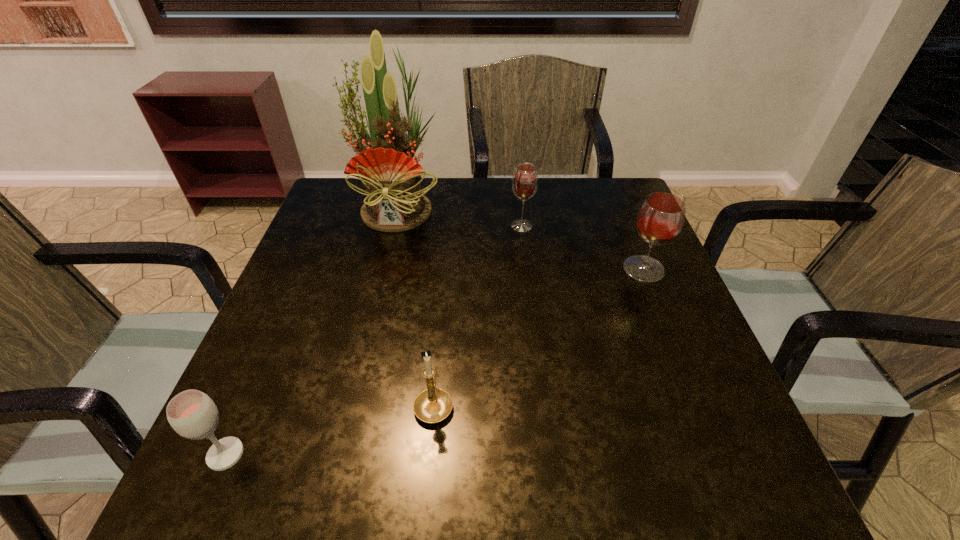
Find the location of a particular element. The width and height of the screenshot is (960, 540). flower arrangement is located at coordinates (391, 177).

Locate an element on the screen. The image size is (960, 540). the third nearest object is located at coordinates (661, 216).

Locate an element on the screen. The height and width of the screenshot is (540, 960). the rightmost wineglass is located at coordinates [661, 216].

You are a GUI agent. You are given a task and a screenshot of the screen. Output one action in this format:
    pyautogui.click(x=<x>, y=<y>)
    Task: Click on the second object from right to left
    
    Given the screenshot: What is the action you would take?
    pyautogui.click(x=525, y=181)

Find the location of `the farthest wineglass`. the farthest wineglass is located at coordinates [x=525, y=181].

Find the location of a particular element. candle holder is located at coordinates (432, 405).

Where is `the leftmost wineglass`? the leftmost wineglass is located at coordinates (192, 414).

You are a GUI agent. You are given a task and a screenshot of the screen. Output one action in this format:
    pyautogui.click(x=<x>, y=<y>)
    Task: Click on the leftmost object
    This screenshot has height=540, width=960.
    Given the screenshot: What is the action you would take?
    pyautogui.click(x=192, y=414)

This screenshot has height=540, width=960. Find the location of `vacant area located 0.140m in front of the flower arrangement with the fan visible`. vacant area located 0.140m in front of the flower arrangement with the fan visible is located at coordinates (384, 273).

Identify the location of blank space located on the left of the second farthest wineglass. This screenshot has height=540, width=960. (576, 269).